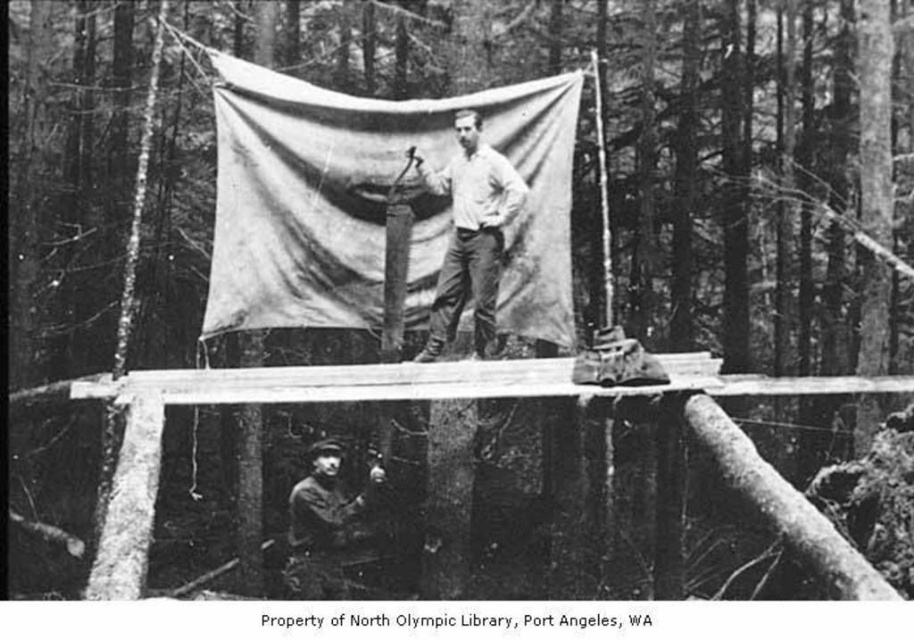
The width and height of the screenshot is (914, 640). What are the coordinates of `matte canvas tarp at center` in the screenshot? It's located at (372, 198).

Who is higher up, matte canvas tarp at center or smooth wood at lower left?

matte canvas tarp at center is higher up.

Find the location of `matte canvas tarp at center`. matte canvas tarp at center is located at coordinates (372, 198).

Which is below, matte canvas tarp at center or smooth white shirt at center?

smooth white shirt at center is below.

Can you confirm if matte canvas tarp at center is positioned to the left of smooth white shirt at center?

Yes, matte canvas tarp at center is to the left of smooth white shirt at center.

Which is in front, point (416, 104) or point (455, 236)?

Point (455, 236) is more forward.

You are a GUI agent. You are given a task and a screenshot of the screen. Output one action in this format:
    pyautogui.click(x=<x>, y=<y>)
    Task: Click on the matte canvas tarp at center
    This screenshot has height=640, width=914.
    Given the screenshot: What is the action you would take?
    pyautogui.click(x=372, y=198)

Can you confirm if smooth white shirt at center is positioned below rugged leather jacket at lower center?

No, smooth white shirt at center is not below rugged leather jacket at lower center.

Does smooth white shirt at center have a smaller size compared to rugged leather jacket at lower center?

Incorrect, smooth white shirt at center is not smaller in size than rugged leather jacket at lower center.

At what (x,y) coordinates should I click in order to perform the action: click on smooth white shirt at center. Please return your answer as a coordinate pair (x, y). The height and width of the screenshot is (640, 914). Looking at the image, I should click on (470, 236).